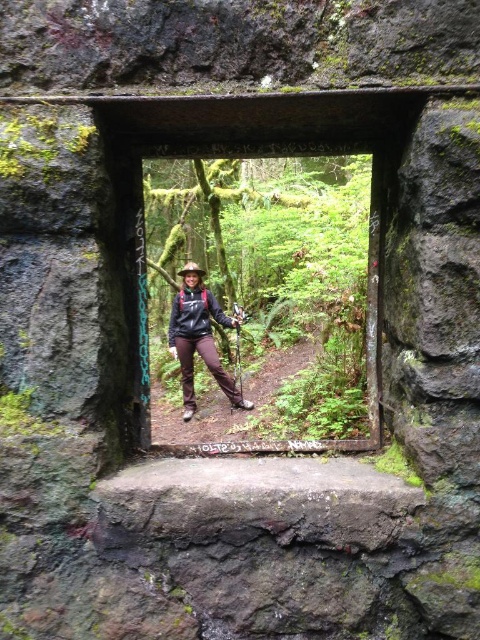
You are standing in front of the rustic stone doorway and want to look through the transparent glass window at center to see the forest beyond. Is the window positioned in the central part of the doorway?

The transparent glass window at center is located at point (267, 304), which is very close to the center of the doorway, so yes, it is positioned in the central part of the doorway.

You are standing in front of the rustic stone doorway and notice both the transparent glass window at center and the matte black jacket at center. Which object would block your view of the forest beyond the doorway more significantly?

The transparent glass window at center is taller than the matte black jacket at center, so the transparent glass window at center would block your view more significantly due to its greater height.